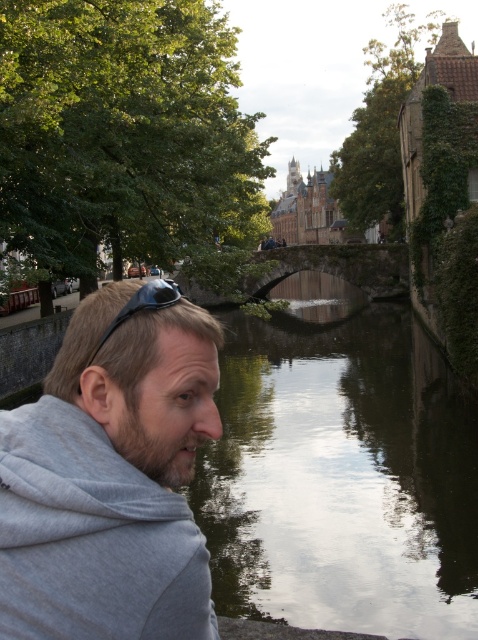
Question: Which of the following is the closest to the observer?

Choices:
 (A) (36, 630)
 (B) (274, 380)

Answer: (A)

Question: Does greenish concrete canal at center have a lesser width compared to gray cotton hoodie at left?

Choices:
 (A) yes
 (B) no

Answer: (B)

Question: Is greenish concrete canal at center below gray cotton hoodie at left?

Choices:
 (A) no
 (B) yes

Answer: (B)

Question: Is greenish concrete canal at center below gray cotton hoodie at left?

Choices:
 (A) no
 (B) yes

Answer: (B)

Question: Which of the following is the closest to the observer?

Choices:
 (A) greenish concrete canal at center
 (B) gray cotton hoodie at left

Answer: (B)